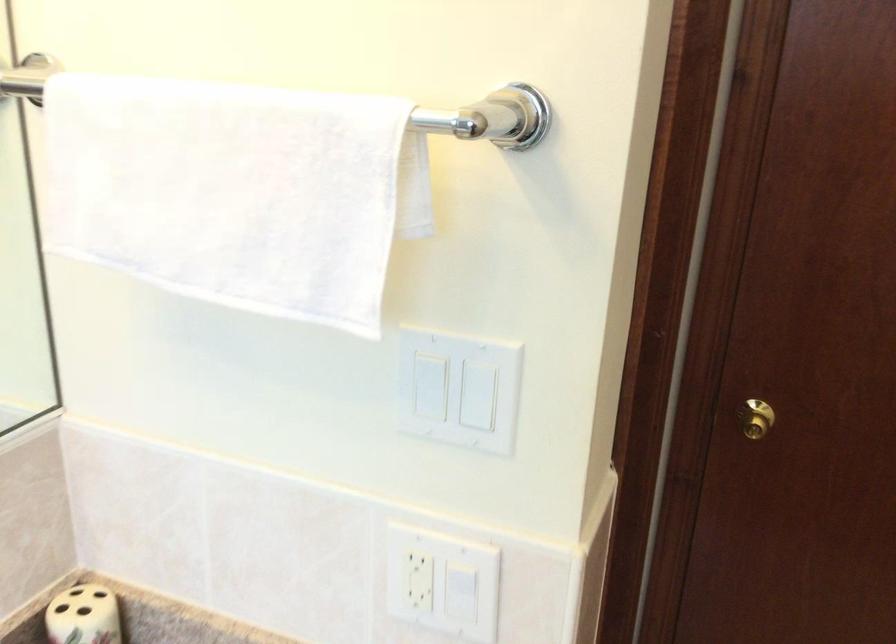
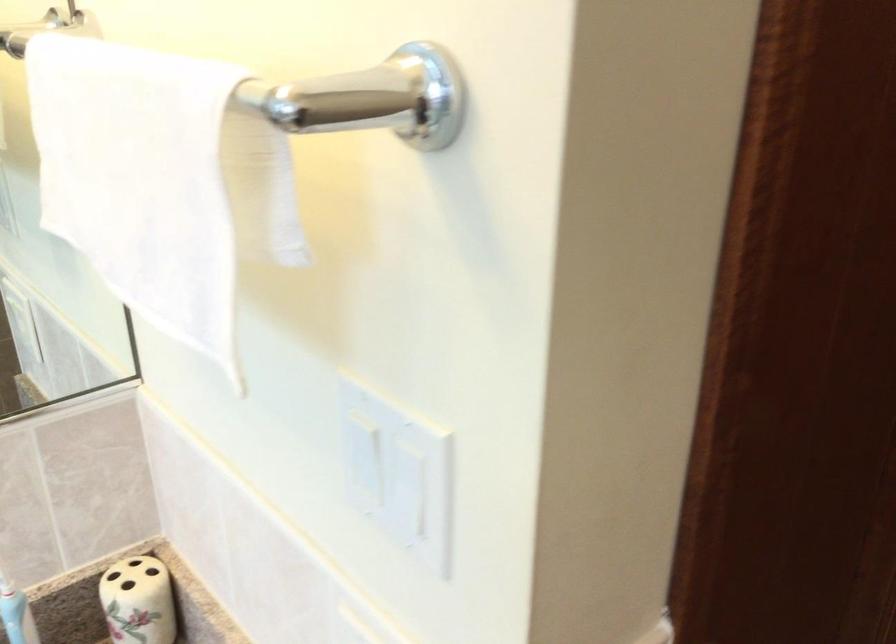
Question: The camera is either moving clockwise (left) or counter-clockwise (right) around the object. The first image is from the beginning of the video and the second image is from the end. Is the camera moving left or right when shooting the video?

Choices:
 (A) Left
 (B) Right

Answer: (B)